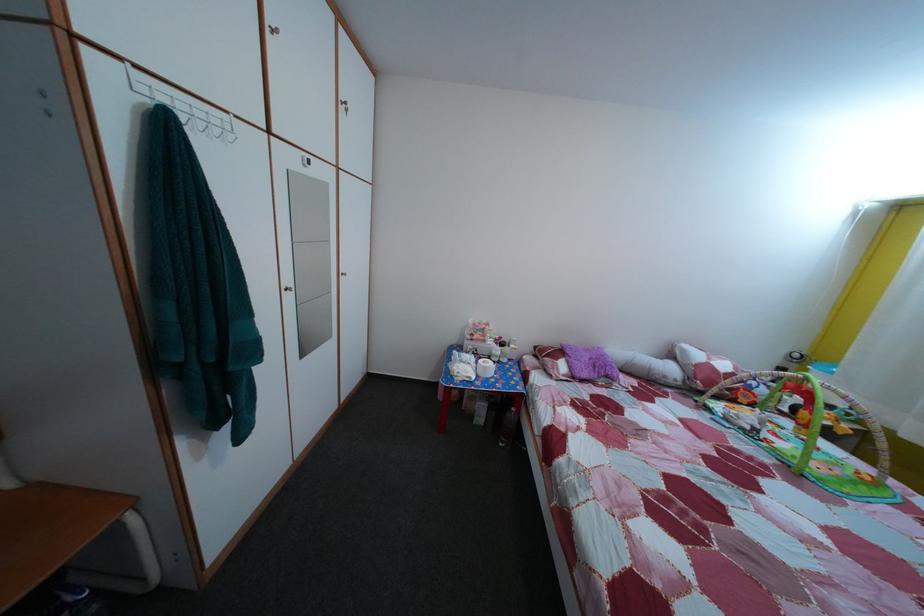
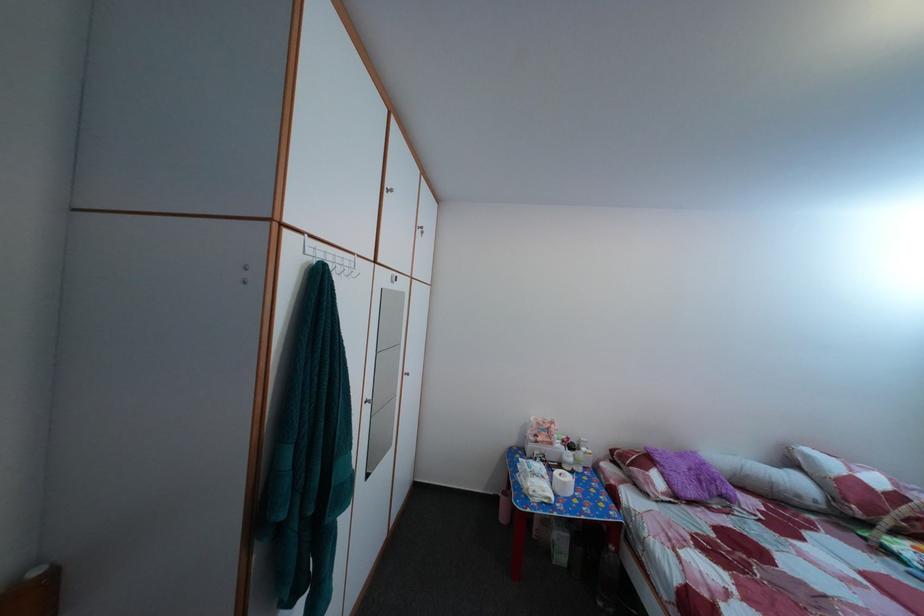
The point at (597, 358) is marked in the first image. Where is the corresponding point in the second image?

(689, 464)